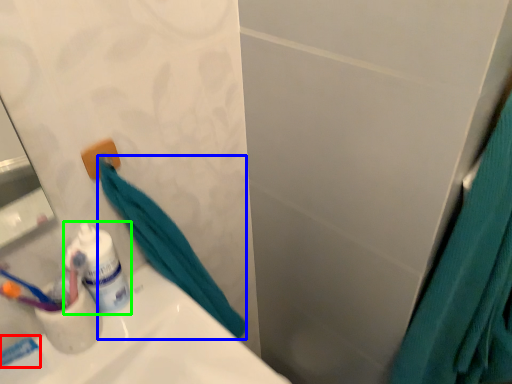
Question: Which object is the farthest from toothpaste (highlighted by a red box)? Choose among these: bath towel (highlighted by a blue box) or toiletry (highlighted by a green box).

Choices:
 (A) bath towel
 (B) toiletry

Answer: (A)